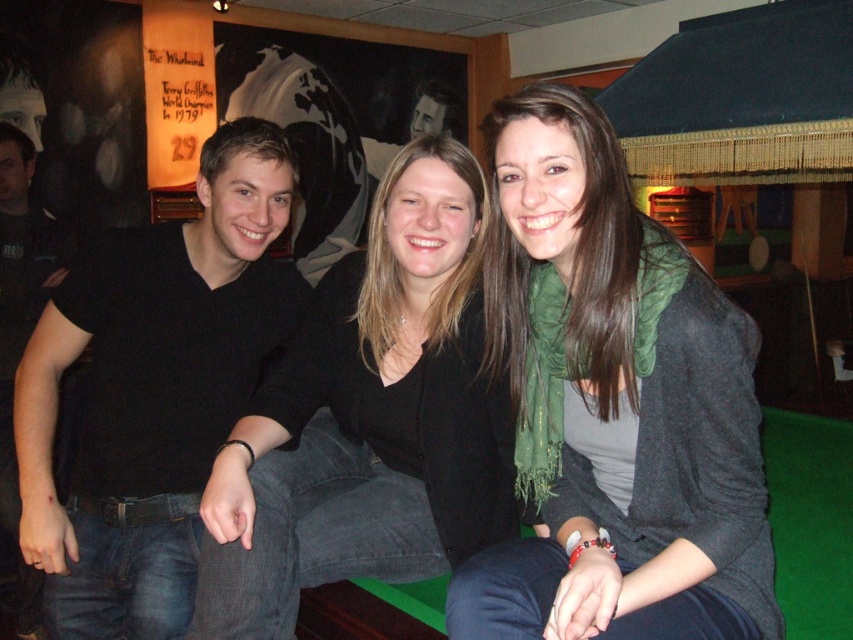
You are standing in the room and see two points marked on the wall. The first point is at coordinates point (485, 563) and the second is at point (283, 595). Which point is closer to you?

Point (485, 563) is in front of point (283, 595), so it is closer to you.

You are a photographer trying to capture a closeup of the green scarf at center and the black matte shirt at center. Which object should you zoom in on more to ensure both fit in the frame?

The green scarf at center is smaller than the black matte shirt at center, so you should zoom in more on the black matte shirt at center to ensure both fit in the frame.

You are taking a photo of the group and need to adjust your focus to the green scarf at center and the black matte shirt at center. Which one is positioned more to the right side of the image?

The green scarf at center is positioned more to the right side of the image than the black matte shirt at center.